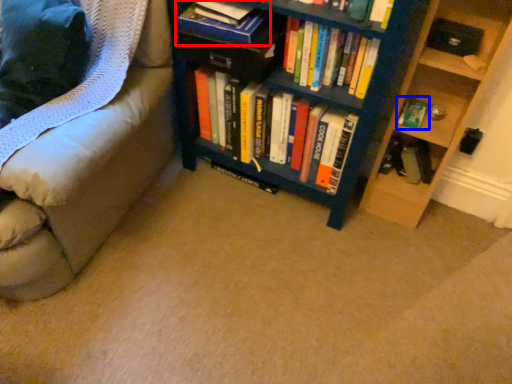
Question: Which point is closer to the camera, book (highlighted by a red box) or book (highlighted by a blue box)?

Choices:
 (A) book
 (B) book

Answer: (A)